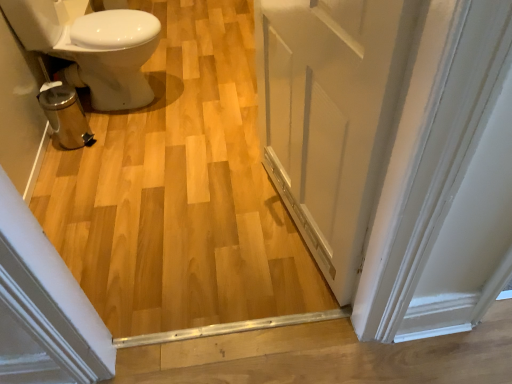
Question: In the image, is white painted wood door at center on the left side or the right side of white glossy bidet at left?

Choices:
 (A) left
 (B) right

Answer: (B)

Question: Is white painted wood door at center inside or outside of white glossy bidet at left?

Choices:
 (A) outside
 (B) inside

Answer: (A)

Question: Is white painted wood door at center in front of or behind white glossy bidet at left in the image?

Choices:
 (A) behind
 (B) front

Answer: (B)

Question: From a real-world perspective, is white glossy bidet at left positioned above or below white painted wood door at center?

Choices:
 (A) below
 (B) above

Answer: (A)

Question: Relative to white painted wood door at center, is white glossy bidet at left in front or behind?

Choices:
 (A) behind
 (B) front

Answer: (A)

Question: Which is correct: white glossy bidet at left is inside white painted wood door at center, or outside of it?

Choices:
 (A) inside
 (B) outside

Answer: (B)

Question: From their relative heights in the image, would you say white glossy bidet at left is taller or shorter than white painted wood door at center?

Choices:
 (A) tall
 (B) short

Answer: (B)